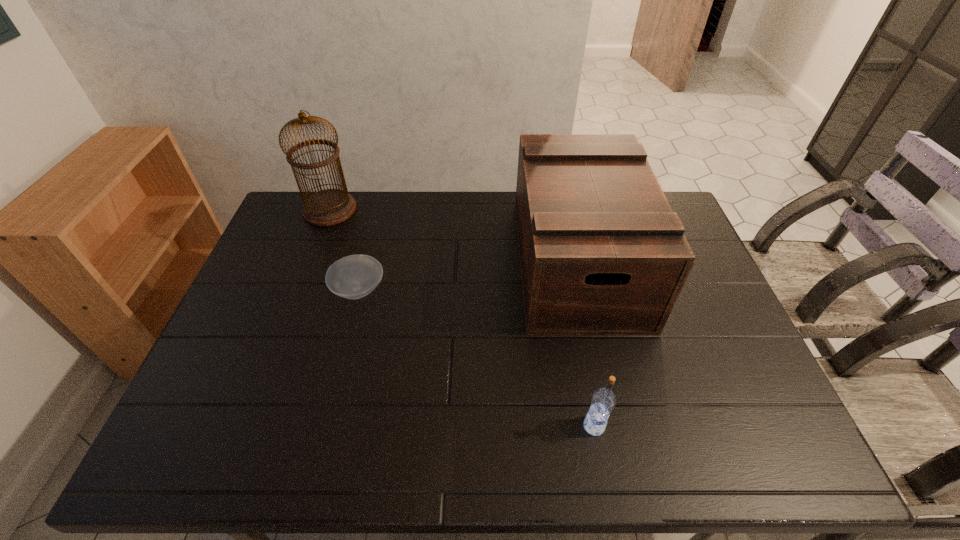
This screenshot has height=540, width=960. Find the location of `vacant point located between the bowl and the birdcage`. vacant point located between the bowl and the birdcage is located at coordinates (345, 250).

Identify which object is the second closest to the tallest object. Please provide its 2D coordinates. Your answer should be formatted as a tuple, i.e. [(x, y)], where the tuple contains the x and y coordinates of a point satisfying the conditions above.

[(601, 252)]

This screenshot has height=540, width=960. I want to click on the third closest object to the third shortest object, so click(x=327, y=207).

Locate an element on the screen. free region that satisfies the following two spatial constraints: 1. on the front-facing side of the tallest object; 2. on the left side of the second object from left to right is located at coordinates (299, 290).

Locate an element on the screen. vacant space that satisfies the following two spatial constraints: 1. on the front-facing side of the leftmost object; 2. on the right side of the shortest object is located at coordinates (299, 290).

This screenshot has width=960, height=540. In order to click on vacant area that satisfies the following two spatial constraints: 1. on the front side of the vodka; 2. on the right side of the third object from right to left in this screenshot , I will do `click(324, 426)`.

The width and height of the screenshot is (960, 540). What are the coordinates of `free location that satisfies the following two spatial constraints: 1. on the front-facing side of the tallest object; 2. on the left side of the shortest object` in the screenshot? It's located at (299, 290).

The image size is (960, 540). Find the location of `vacant space that satisfies the following two spatial constraints: 1. on the front-facing side of the leftmost object; 2. on the left side of the third tallest object`. vacant space that satisfies the following two spatial constraints: 1. on the front-facing side of the leftmost object; 2. on the left side of the third tallest object is located at coordinates [x=246, y=426].

Identify the location of vacant region that satisfies the following two spatial constraints: 1. on the front-facing side of the leftmost object; 2. on the left side of the bowl. [x=299, y=290].

This screenshot has height=540, width=960. I want to click on vacant space that satisfies the following two spatial constraints: 1. on the back side of the nearest object; 2. on the right side of the box, so click(564, 262).